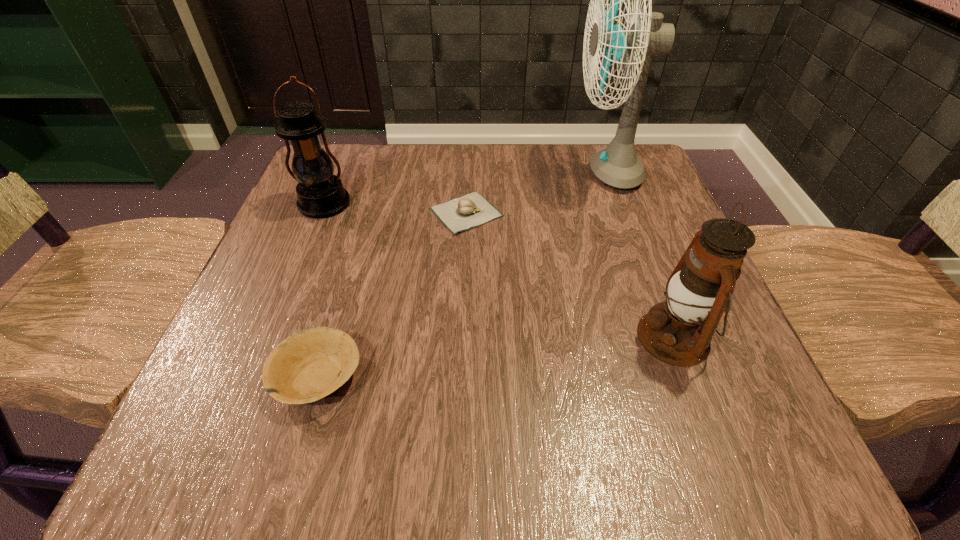
Find the location of a particular element. This screenshot has height=540, width=960. free point that satisfies the following two spatial constraints: 1. above the garlic, indicating its light source; 2. on the left side of the farther lantern is located at coordinates (321, 212).